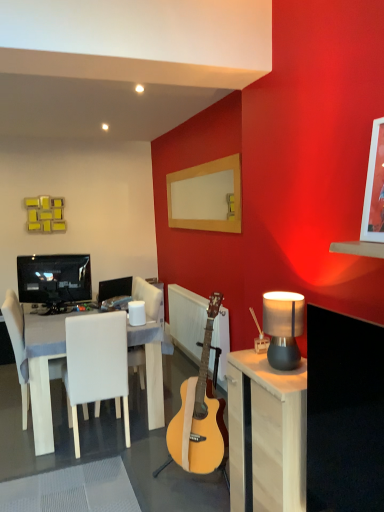
The width and height of the screenshot is (384, 512). What are the coordinates of `matte black lamp at right` in the screenshot? It's located at pos(283,327).

The width and height of the screenshot is (384, 512). What do you see at coordinates (114, 288) in the screenshot?
I see `matte black monitor at center, which is the 1th television in back-to-front order` at bounding box center [114, 288].

Locate an element on the screen. light wood acoustic guitar at center is located at coordinates (200, 413).

Identify the location of white leather chair at center, positioned as the second chair in left-to-right order. (96, 366).

At what (x,y) coordinates should I click in order to perform the action: click on matte black television at left, which is the 2th television in right-to-left order. Please return your answer as a coordinate pair (x, y). This screenshot has width=384, height=512. Looking at the image, I should click on click(x=54, y=280).

Which object is positioned more to the right, white wood table at left or matte black monitor at center, which is the 1th television in back-to-front order?

matte black monitor at center, which is the 1th television in back-to-front order, is more to the right.

From a real-world perspective, is white wood table at left beneath matte black monitor at center, which is the 2th television in front-to-back order?

Correct, in the physical world, white wood table at left is lower than matte black monitor at center, which is the 2th television in front-to-back order.

Considering the relative sizes of white wood table at left and matte black monitor at center, which is the 2th television in front-to-back order, in the image provided, is white wood table at left thinner than matte black monitor at center, which is the 2th television in front-to-back order,?

Incorrect, the width of white wood table at left is not less than that of matte black monitor at center, which is the 2th television in front-to-back order.

Is white wood table at left not within matte black monitor at center, the second television positioned from the left?

white wood table at left lies outside matte black monitor at center, the second television positioned from the left,'s area.

Is matte black television at left, which is the 1th television from left to right, further to camera compared to white fabric chair at left, acting as the first chair starting from the left?

That is True.

Which television is the 1st one when counting from the back of the white fabric chair at left, the 2th chair from the right? Please provide its 2D coordinates.

[(54, 280)]

Considering the sizes of objects matte black television at left, which is the 2th television in right-to-left order, and white fabric chair at left, the 2th chair from the right, in the image provided, who is thinner, matte black television at left, which is the 2th television in right-to-left order, or white fabric chair at left, the 2th chair from the right,?

With smaller width is matte black television at left, which is the 2th television in right-to-left order.

Can we say matte black television at left, the second television viewed from the back, lies outside white wood table at left?

Absolutely, matte black television at left, the second television viewed from the back, is external to white wood table at left.

The height and width of the screenshot is (512, 384). I want to click on television that is on the left side of white wood table at left, so click(x=54, y=280).

How distant is matte black television at left, marked as the 1th television in a front-to-back arrangement, from white wood table at left?

21.97 inches.

From the image's perspective, does matte black television at left, the second television viewed from the back, appear higher than white wood table at left?

Indeed, from the image's perspective, matte black television at left, the second television viewed from the back, is shown above white wood table at left.

Considering the relative sizes of matte black monitor at center, which appears as the first television when viewed from the right, and white leather chair at center, arranged as the first chair when viewed from the right, in the image provided, is matte black monitor at center, which appears as the first television when viewed from the right, smaller than white leather chair at center, arranged as the first chair when viewed from the right,?

Correct, matte black monitor at center, which appears as the first television when viewed from the right, occupies less space than white leather chair at center, arranged as the first chair when viewed from the right.

From a real-world perspective, count 1st televisions upward from the white leather chair at center, arranged as the first chair when viewed from the right, and point to it. Please provide its 2D coordinates.

[(114, 288)]

Is matte black monitor at center, which is the 1th television in back-to-front order, next to white leather chair at center, positioned as the second chair in left-to-right order, and touching it?

No, matte black monitor at center, which is the 1th television in back-to-front order, is not next to white leather chair at center, positioned as the second chair in left-to-right order.

Is matte black monitor at center, which appears as the first television when viewed from the right, aimed at white leather chair at center, arranged as the first chair when viewed from the right?

No, matte black monitor at center, which appears as the first television when viewed from the right, is not oriented towards white leather chair at center, arranged as the first chair when viewed from the right.

Does white leather chair at center, arranged as the first chair when viewed from the right, touch matte black lamp at right?

white leather chair at center, arranged as the first chair when viewed from the right, is not next to matte black lamp at right, and they're not touching.

Can you confirm if white leather chair at center, arranged as the first chair when viewed from the right, is shorter than matte black lamp at right?

Incorrect, the height of white leather chair at center, arranged as the first chair when viewed from the right, does not fall short of that of matte black lamp at right.

Between white leather chair at center, arranged as the first chair when viewed from the right, and matte black lamp at right, which one has larger width?

Wider between the two is white leather chair at center, arranged as the first chair when viewed from the right.

Considering their positions, is white wood table at left located in front of or behind matte black lamp at right?

white wood table at left is behind matte black lamp at right.

Where is `lamp on the right of white wood table at left`? This screenshot has width=384, height=512. lamp on the right of white wood table at left is located at coordinates (283, 327).

How many degrees apart are the facing directions of white wood table at left and matte black lamp at right?

The angular difference between white wood table at left and matte black lamp at right is 2.82 degrees.

How far apart are white wood table at left and matte black lamp at right?

white wood table at left and matte black lamp at right are 1.55 meters apart from each other.

Between wooden frame at upper right and white wood table at left, which one is positioned in front?

white wood table at left.

Is wooden frame at upper right far away from white wood table at left?

Yes.

Image resolution: width=384 pixels, height=512 pixels. In order to click on television on the right of the white wood table at left in this screenshot , I will do `click(114, 288)`.

At what (x,y) coordinates should I click in order to perform the action: click on the 1st television behind when counting from the white fabric chair at left, the 2th chair from the right. Please return your answer as a coordinate pair (x, y). Image resolution: width=384 pixels, height=512 pixels. Looking at the image, I should click on (54, 280).

Which object lies nearer to the anchor point white wood table at left, wooden frame at upper right or light wood cabinet at right?

Based on the image, light wood cabinet at right appears to be nearer to white wood table at left.

Which object lies further to the anchor point matte black monitor at center, which is the 2th television in front-to-back order, wooden picture frame at upper right or matte black lamp at right?

Among the two, wooden picture frame at upper right is located further to matte black monitor at center, which is the 2th television in front-to-back order.

Which object lies nearer to the anchor point wooden picture frame at upper right, matte black lamp at right or wooden frame at upper right?

matte black lamp at right.

Considering their positions, is light wood cabinet at right positioned closer to light wood acoustic guitar at center than matte black television at left, which is the 2th television in right-to-left order?

The object closer to light wood acoustic guitar at center is light wood cabinet at right.

Which object lies further to the anchor point matte black lamp at right, light wood cabinet at right or wooden picture frame at upper right?

The object further to matte black lamp at right is wooden picture frame at upper right.

Which object lies further to the anchor point light wood acoustic guitar at center, wooden picture frame at upper right or white fabric chair at left, the 2th chair from the right?

wooden picture frame at upper right.

Based on their spatial positions, is white fabric chair at left, acting as the first chair starting from the left, or matte black television at left, which is the 1th television from left to right, closer to light wood cabinet at right?

white fabric chair at left, acting as the first chair starting from the left, is closer to light wood cabinet at right.

In the scene shown: Which object lies nearer to the anchor point wooden frame at upper right, matte black lamp at right or light wood cabinet at right?

Based on the image, matte black lamp at right appears to be nearer to wooden frame at upper right.

The image size is (384, 512). What are the coordinates of `television between white fabric chair at left, acting as the first chair starting from the left, and matte black monitor at center, which is the 2th television in front-to-back order, from front to back` in the screenshot? It's located at (54, 280).

Locate an element on the screen. chair positioned between white wood table at left and matte black monitor at center, which is the 2th television in front-to-back order, from near to far is located at coordinates (17, 344).

The height and width of the screenshot is (512, 384). Find the location of `guitar between wooden picture frame at upper right and matte black monitor at center, which is the 1th television in back-to-front order, in the front-back direction`. guitar between wooden picture frame at upper right and matte black monitor at center, which is the 1th television in back-to-front order, in the front-back direction is located at coordinates (200, 413).

Identify the location of table between wooden picture frame at upper right and wooden frame at upper right along the z-axis. (43, 372).